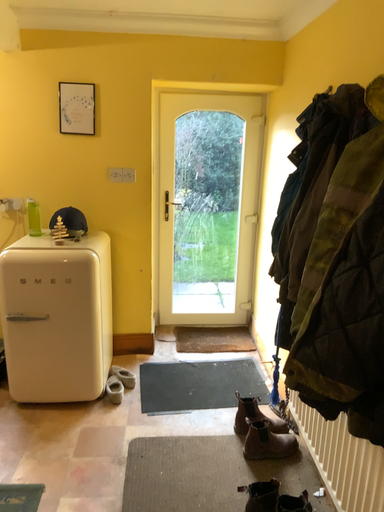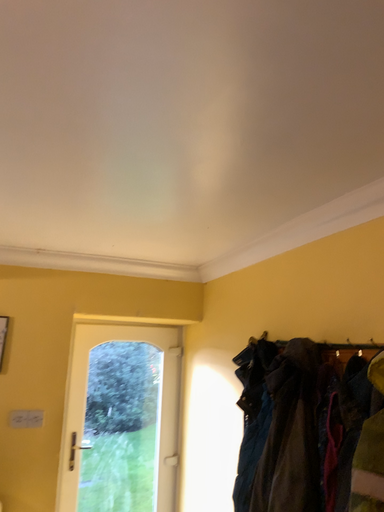
Question: How did the camera likely rotate when shooting the video?

Choices:
 (A) rotated upward
 (B) rotated downward

Answer: (A)